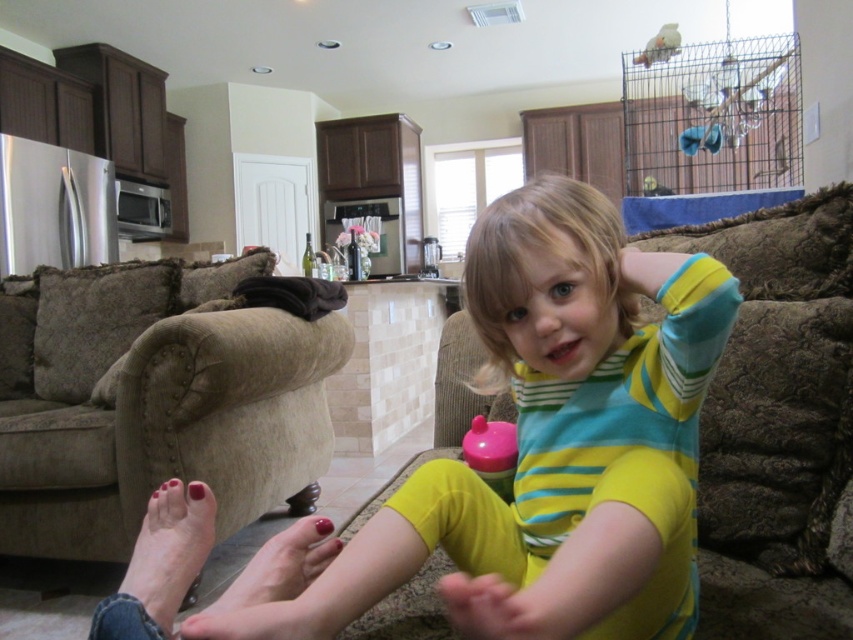
Does brown textured couch at center have a larger size compared to matte skin foot at lower left?

Correct, brown textured couch at center is larger in size than matte skin foot at lower left.

Can you confirm if brown textured couch at center is wider than matte skin foot at lower left?

Yes, brown textured couch at center is wider than matte skin foot at lower left.

Find the location of `brown textured couch at center`. brown textured couch at center is located at coordinates (572, 432).

Locate an element on the screen. This screenshot has height=640, width=853. yellow striped shirt at center is located at coordinates (550, 444).

Does yellow striped shirt at center appear on the right side of smooth skin foot at lower left?

Yes, yellow striped shirt at center is to the right of smooth skin foot at lower left.

Who is more forward, (686, 380) or (260, 548)?

Point (686, 380)

At what (x,y) coordinates should I click in order to perform the action: click on yellow striped shirt at center. Please return your answer as a coordinate pair (x, y). Looking at the image, I should click on (550, 444).

Who is more distant from viewer, (113, 451) or (310, 566)?

The point (113, 451) is more distant.

Where is `beige fabric couch at left`? Image resolution: width=853 pixels, height=640 pixels. beige fabric couch at left is located at coordinates (167, 422).